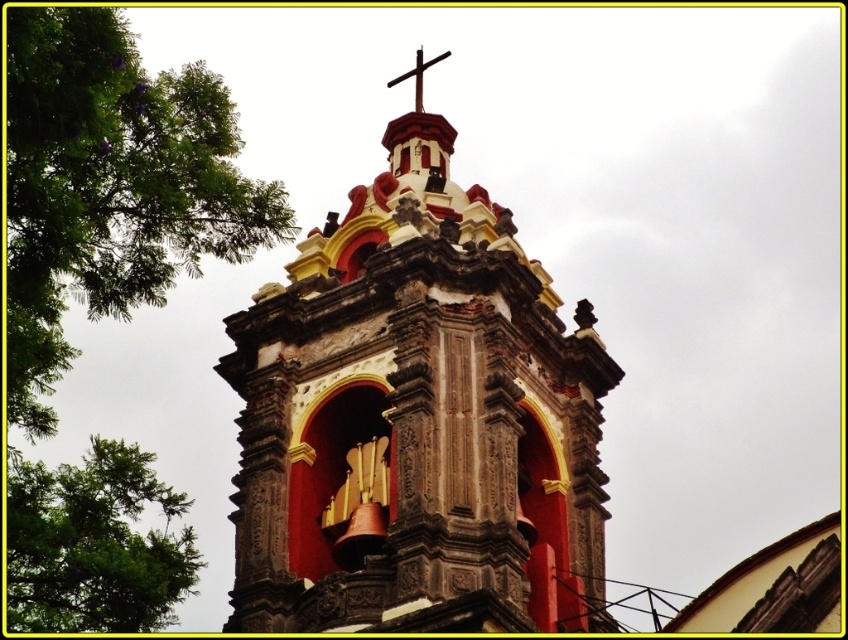
Question: Based on their relative distances, which object is nearer to the red stone bell tower at center?

Choices:
 (A) green leafy tree at upper left
 (B) smooth wooden cross at upper center

Answer: (A)

Question: Which of the following is the closest to the observer?

Choices:
 (A) red stone bell tower at center
 (B) green leafy tree at upper left

Answer: (B)

Question: Does red stone bell tower at center appear on the right side of smooth wooden cross at upper center?

Choices:
 (A) yes
 (B) no

Answer: (A)

Question: Does red stone bell tower at center lie in front of green leafy tree at lower left?

Choices:
 (A) yes
 (B) no

Answer: (A)

Question: Can you confirm if red stone bell tower at center is positioned to the left of green leafy tree at lower left?

Choices:
 (A) no
 (B) yes

Answer: (A)

Question: Based on their relative distances, which object is farther from the smooth wooden cross at upper center?

Choices:
 (A) green leafy tree at upper left
 (B) green leafy tree at lower left
 (C) red stone bell tower at center

Answer: (A)